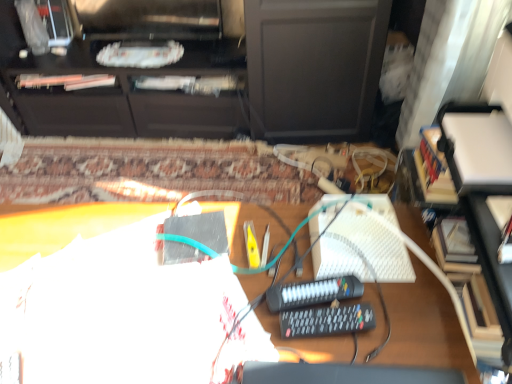
This screenshot has height=384, width=512. What do you see at coordinates (130, 72) in the screenshot? I see `black matte cabinet at upper center` at bounding box center [130, 72].

You are a GUI agent. You are given a task and a screenshot of the screen. Output one action in this format:
    pyautogui.click(x=<x>, y=<y>)
    Task: Click on the black matte cabinet at upper center
    
    Given the screenshot: What is the action you would take?
    pyautogui.click(x=130, y=72)

The width and height of the screenshot is (512, 384). What are the coordinates of `black plastic remote control at center, which is counted as the 2th equipment, starting from the back` in the screenshot? It's located at (326, 321).

Identify the location of white textured keyboard at center-right. This screenshot has width=512, height=384. (375, 244).

Measure the distance between point (304, 285) and camera.

Point (304, 285) and camera are 33.23 inches apart.

What do you see at coordinates (313, 293) in the screenshot? I see `black plastic remote control at center, arranged as the 1th equipment when viewed from the back` at bounding box center [313, 293].

Locate an element on the screen. The width and height of the screenshot is (512, 384). black matte cabinet at upper center is located at coordinates (130, 72).

Is white textured keyboard at center-right with black plastic remote control at center, which is counted as the 2th equipment, starting from the back?

white textured keyboard at center-right is not next to black plastic remote control at center, which is counted as the 2th equipment, starting from the back, and they're not touching.

Which is in front, point (372, 241) or point (333, 329)?

The point (333, 329) is closer.

From the image's perspective, count 2nd equipments downward from the white textured keyboard at center-right and point to it. Please provide its 2D coordinates.

[(326, 321)]

Which is more to the left, white textured keyboard at center-right or black plastic remote control at center, marked as the 1th equipment in a front-to-back arrangement?

Positioned to the left is black plastic remote control at center, marked as the 1th equipment in a front-to-back arrangement.

From the picture: Between white textured keyboard at center-right and black matte cabinet at upper center, which one is positioned in front?

Positioned in front is white textured keyboard at center-right.

Find the location of a particular element. keyboard on the right of black matte cabinet at upper center is located at coordinates (375, 244).

From the image's perspective, between white textured keyboard at center-right and black matte cabinet at upper center, which one is located above?

black matte cabinet at upper center, from the image's perspective.

Is white textured keyboard at center-right facing away from black matte cabinet at upper center?

That's not correct — white textured keyboard at center-right is not looking away from black matte cabinet at upper center.

From a real-world perspective, is white textured keyboard at center-right positioned above or below black plastic remote control at center, which appears as the second equipment when viewed from the front?

white textured keyboard at center-right is situated higher than black plastic remote control at center, which appears as the second equipment when viewed from the front, in the real world.

From the image's perspective, is white textured keyboard at center-right above or below black plastic remote control at center, arranged as the 1th equipment when viewed from the back?

Based on their image positions, white textured keyboard at center-right is located above black plastic remote control at center, arranged as the 1th equipment when viewed from the back.

Is white textured keyboard at center-right facing away from black plastic remote control at center, which appears as the second equipment when viewed from the front?

Yes, white textured keyboard at center-right's orientation is away from black plastic remote control at center, which appears as the second equipment when viewed from the front.

Which is farther from the camera, (408, 234) or (331, 318)?

The point (408, 234) is behind.

Is white matte desk at center positioned beyond the bounds of black plastic remote control at center, which is counted as the 2th equipment, starting from the back?

white matte desk at center lies outside black plastic remote control at center, which is counted as the 2th equipment, starting from the back,'s area.

From the image's perspective, is white matte desk at center located above black plastic remote control at center, marked as the 1th equipment in a front-to-back arrangement?

No, from the image's perspective, white matte desk at center is not on top of black plastic remote control at center, marked as the 1th equipment in a front-to-back arrangement.

Based on the photo, would you consider white matte desk at center to be distant from black plastic remote control at center, marked as the 1th equipment in a front-to-back arrangement?

No, white matte desk at center is in close proximity to black plastic remote control at center, marked as the 1th equipment in a front-to-back arrangement.

How many degrees apart are the facing directions of white matte desk at center and black plastic remote control at center, which appears as the second equipment when viewed from the front?

They differ by 104 degrees in their facing directions.

Is the surface of white matte desk at center in direct contact with black plastic remote control at center, arranged as the 1th equipment when viewed from the back?

There is a gap between white matte desk at center and black plastic remote control at center, arranged as the 1th equipment when viewed from the back.

Is point (352, 342) less distant than point (280, 306)?

That is True.

Does white matte desk at center appear on the left side of black plastic remote control at center, arranged as the 1th equipment when viewed from the back?

Yes.

Considering the sizes of objects white matte desk at center and black matte cabinet at upper center in the image provided, who is wider, white matte desk at center or black matte cabinet at upper center?

Wider between the two is black matte cabinet at upper center.

Considering their positions, is white matte desk at center located in front of or behind black matte cabinet at upper center?

Clearly, white matte desk at center is in front of black matte cabinet at upper center.

Based on the photo, from a real-world perspective, which object rests below the other?

From a 3D spatial view, white matte desk at center is below.

Where is `desk below the black matte cabinet at upper center (from a real-world perspective)`? The width and height of the screenshot is (512, 384). desk below the black matte cabinet at upper center (from a real-world perspective) is located at coordinates (x=425, y=326).

In the scene shown: Is white matte desk at center at the back of black matte cabinet at upper center?

No, black matte cabinet at upper center is not facing away from white matte desk at center.

From the image's perspective, is black matte cabinet at upper center located above white matte desk at center?

Yes, from the image's perspective, black matte cabinet at upper center is on top of white matte desk at center.

Can you confirm if black matte cabinet at upper center is wider than white matte desk at center?

Indeed, black matte cabinet at upper center has a greater width compared to white matte desk at center.

Where is `equipment that is the 2nd object located in front of the white textured keyboard at center-right`? The height and width of the screenshot is (384, 512). equipment that is the 2nd object located in front of the white textured keyboard at center-right is located at coordinates (326, 321).

Where is `furniture lying behind the white textured keyboard at center-right`? furniture lying behind the white textured keyboard at center-right is located at coordinates (130, 72).

Considering their positions, is white textured keyboard at center-right positioned closer to black plastic remote control at center, arranged as the 1th equipment when viewed from the back, than black plastic remote control at center, which is counted as the 2th equipment, starting from the back?

black plastic remote control at center, which is counted as the 2th equipment, starting from the back, is positioned closer to the anchor black plastic remote control at center, arranged as the 1th equipment when viewed from the back.

Considering their positions, is black matte cabinet at upper center positioned closer to black plastic remote control at center, which appears as the second equipment when viewed from the front, than white textured keyboard at center-right?

Based on the image, white textured keyboard at center-right appears to be nearer to black plastic remote control at center, which appears as the second equipment when viewed from the front.

When comparing their distances from white matte desk at center, does black plastic remote control at center, which is counted as the 2th equipment, starting from the back, or black matte cabinet at upper center seem closer?

Among the two, black plastic remote control at center, which is counted as the 2th equipment, starting from the back, is located nearer to white matte desk at center.

From the image, which object appears to be nearer to white matte desk at center, black plastic remote control at center, which is counted as the 2th equipment, starting from the back, or white textured keyboard at center-right?

white textured keyboard at center-right lies closer to white matte desk at center than the other object.

Based on the photo, when comparing their distances from black plastic remote control at center, which appears as the second equipment when viewed from the front, does black matte cabinet at upper center or black plastic remote control at center, marked as the 1th equipment in a front-to-back arrangement, seem further?

black matte cabinet at upper center is positioned further to the anchor black plastic remote control at center, which appears as the second equipment when viewed from the front.

Which object lies nearer to the anchor point white textured keyboard at center-right, black plastic remote control at center, which appears as the second equipment when viewed from the front, or black matte cabinet at upper center?

black plastic remote control at center, which appears as the second equipment when viewed from the front, is positioned closer to the anchor white textured keyboard at center-right.

Looking at the image, which one is located closer to black matte cabinet at upper center, black plastic remote control at center, arranged as the 1th equipment when viewed from the back, or white textured keyboard at center-right?

white textured keyboard at center-right is closer to black matte cabinet at upper center.

Based on the photo, looking at the image, which one is located further to black plastic remote control at center, which appears as the second equipment when viewed from the front, white matte desk at center or black plastic remote control at center, marked as the 1th equipment in a front-to-back arrangement?

white matte desk at center.

Locate an element on the screen. keyboard between black plastic remote control at center, marked as the 1th equipment in a front-to-back arrangement, and black matte cabinet at upper center in the front-back direction is located at coordinates (375, 244).

Find the location of a particular element. This screenshot has width=512, height=384. keyboard positioned between black plastic remote control at center, arranged as the 1th equipment when viewed from the back, and black matte cabinet at upper center from near to far is located at coordinates (375, 244).

Image resolution: width=512 pixels, height=384 pixels. I want to click on equipment between black matte cabinet at upper center and black plastic remote control at center, marked as the 1th equipment in a front-to-back arrangement, in the vertical direction, so click(313, 293).

Locate an element on the screen. This screenshot has width=512, height=384. equipment situated between white matte desk at center and black plastic remote control at center, marked as the 1th equipment in a front-to-back arrangement, from left to right is located at coordinates (313, 293).